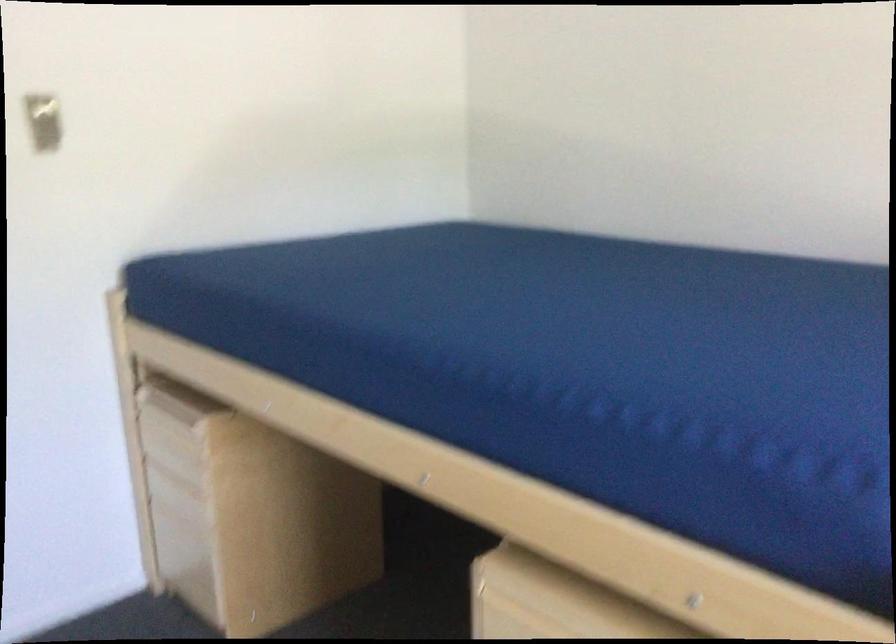
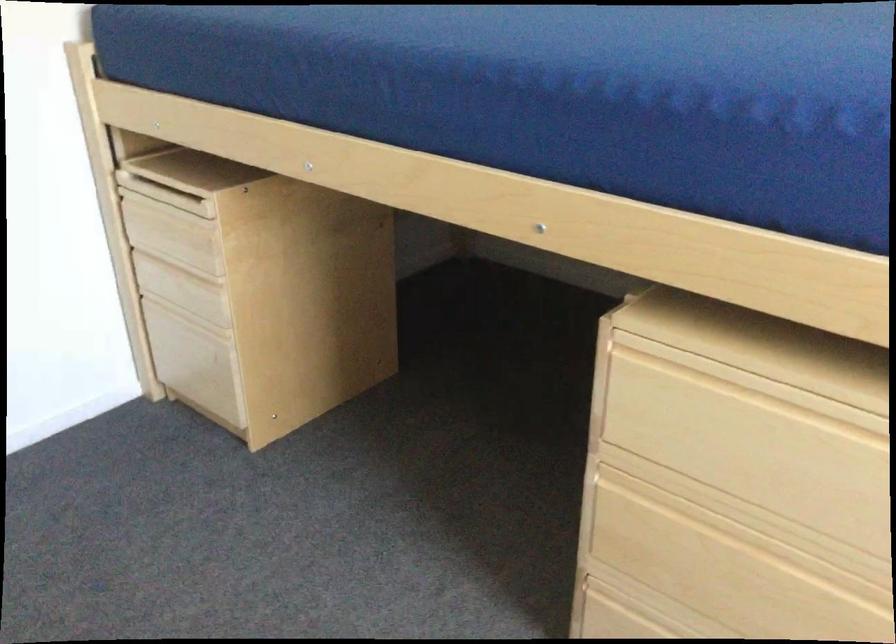
Locate, in the second image, the point that corresponds to (x=210, y=433) in the first image.

(220, 214)